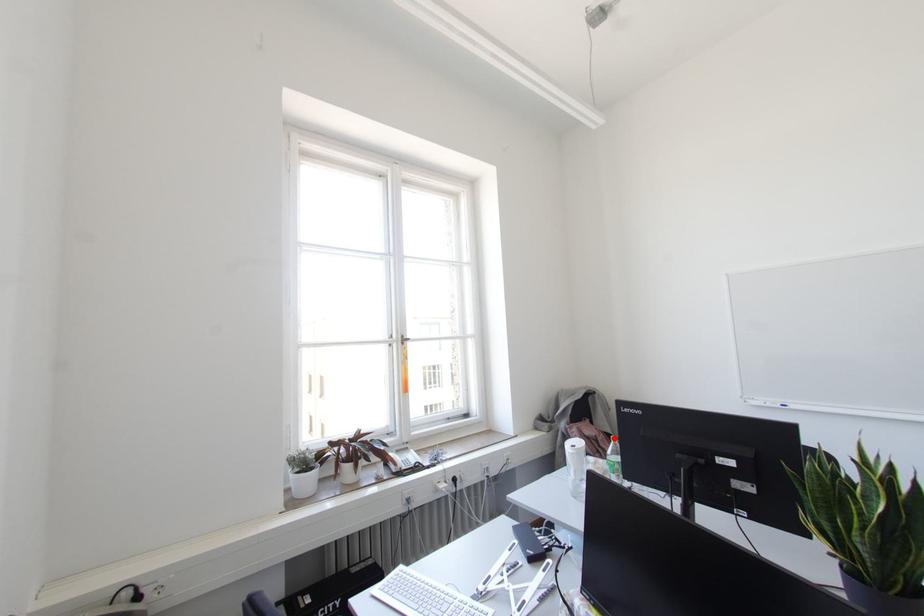
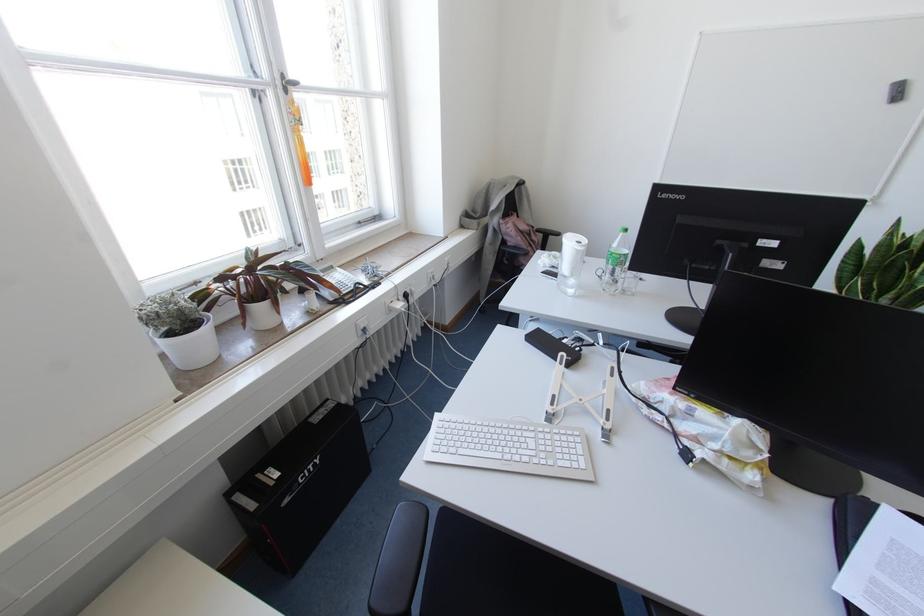
Question: I am providing you with two images of the same scene from different viewpoints. Given a red point in image1, look at the same physical point in image2. Is it:

Choices:
 (A) Closer to the viewpoint
 (B) Farther from the viewpoint

Answer: (B)